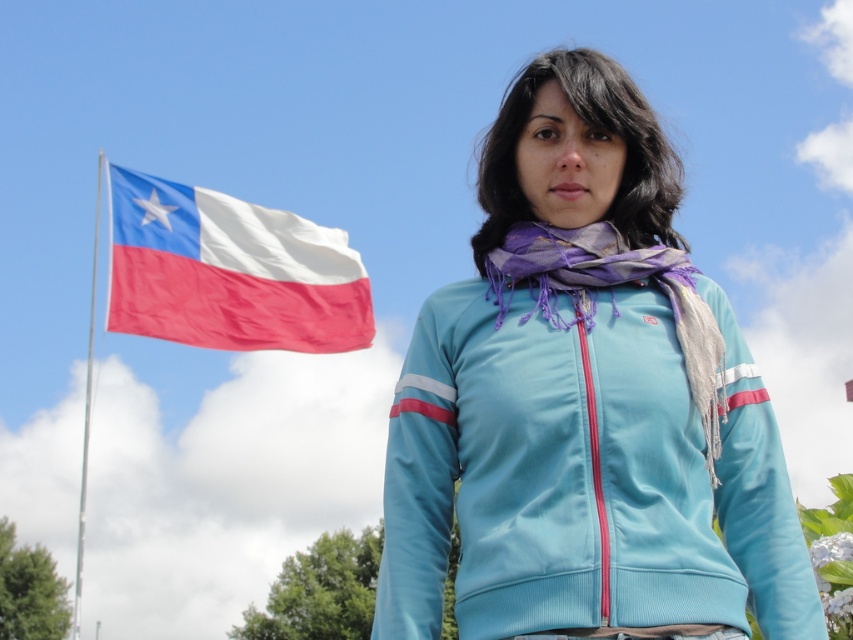
Question: Which point appears closest to the camera in this image?

Choices:
 (A) (689, 284)
 (B) (538, 273)
 (C) (96, 228)
 (D) (363, 324)

Answer: (B)

Question: Based on their relative distances, which object is nearer to the red fabric chilean flag at left?

Choices:
 (A) purple silk scarf at center
 (B) silver metallic flag pole at left

Answer: (A)

Question: Is matte blue jacket at center wider than purple silk scarf at center?

Choices:
 (A) no
 (B) yes

Answer: (B)

Question: Is purple silk scarf at center below silver metallic flag pole at left?

Choices:
 (A) yes
 (B) no

Answer: (B)

Question: Does matte blue jacket at center appear over silver metallic flag pole at left?

Choices:
 (A) no
 (B) yes

Answer: (B)

Question: Which point is farther to the camera?

Choices:
 (A) matte blue jacket at center
 (B) silver metallic flag pole at left
 (C) purple silk scarf at center
 (D) red fabric chilean flag at left

Answer: (B)